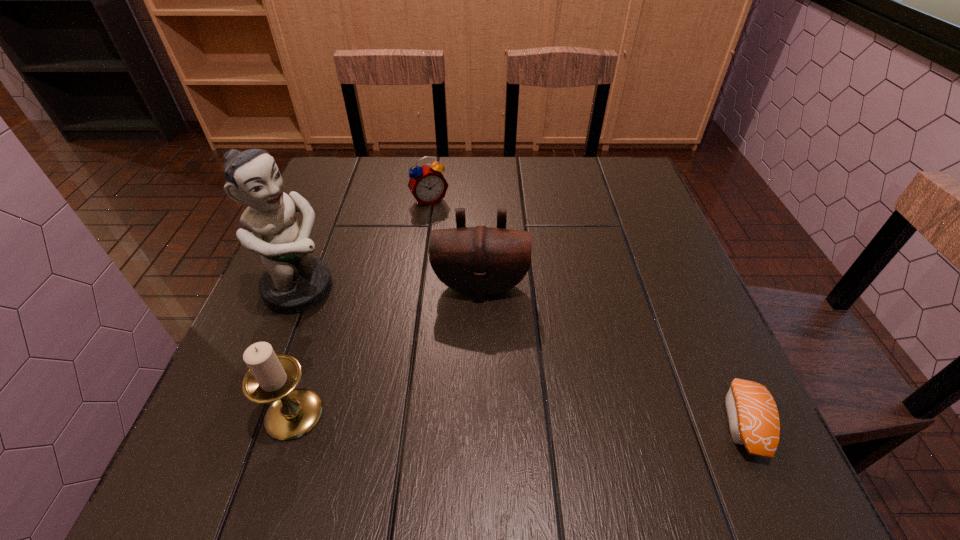
The height and width of the screenshot is (540, 960). Identify the location of vacant region between the tallest object and the pouch. (391, 288).

Where is `empty space that is in between the figurine and the candle holder`? The width and height of the screenshot is (960, 540). empty space that is in between the figurine and the candle holder is located at coordinates (298, 352).

Identify the location of object that is the closest one to the rightmost object. Image resolution: width=960 pixels, height=540 pixels. (480, 261).

Locate an element on the screen. The image size is (960, 540). the second closest object to the pouch is located at coordinates (427, 184).

Locate an element on the screen. blank area in the image that satisfies the following two spatial constraints: 1. on the front side of the candle holder; 2. on the left side of the shortest object is located at coordinates (291, 423).

Where is `free space that satisfies the following two spatial constraints: 1. on the front side of the tallest object; 2. on the right side of the rightmost object`? free space that satisfies the following two spatial constraints: 1. on the front side of the tallest object; 2. on the right side of the rightmost object is located at coordinates (249, 423).